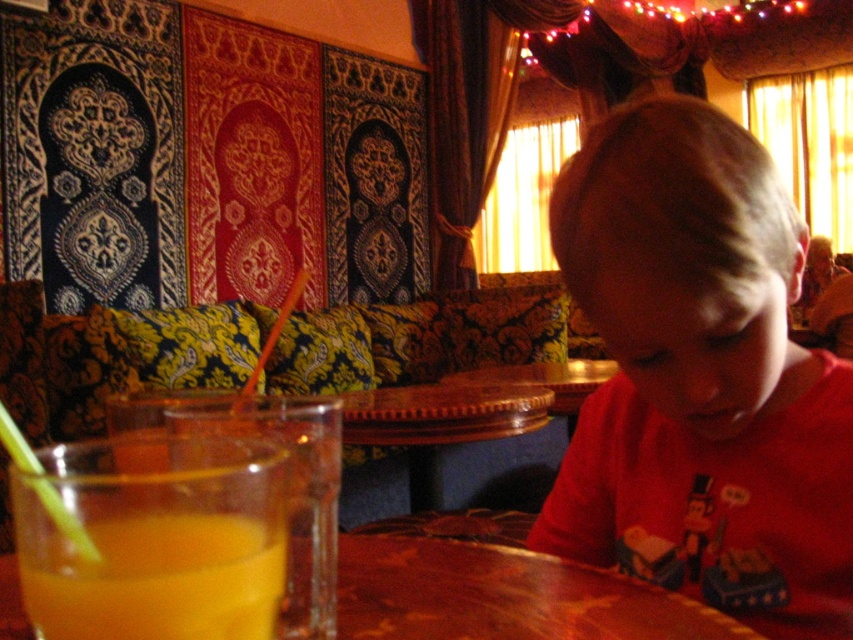
Can you confirm if red matte shirt at lower right is smaller than wooden table at center?

No.

Is red matte shirt at lower right thinner than wooden table at center?

Indeed, red matte shirt at lower right has a lesser width compared to wooden table at center.

The width and height of the screenshot is (853, 640). I want to click on red matte shirt at lower right, so click(700, 378).

Find the location of `red matte shirt at lower right`. red matte shirt at lower right is located at coordinates (700, 378).

Does red matte shirt at lower right come in front of yellow translucent liquid at lower left?

No, it is behind yellow translucent liquid at lower left.

Does red matte shirt at lower right have a smaller size compared to yellow translucent liquid at lower left?

Incorrect, red matte shirt at lower right is not smaller in size than yellow translucent liquid at lower left.

The image size is (853, 640). I want to click on red matte shirt at lower right, so click(x=700, y=378).

Where is `red matte shirt at lower right`? This screenshot has width=853, height=640. red matte shirt at lower right is located at coordinates click(x=700, y=378).

Who is positioned more to the right, yellow translucent liquid at lower left or wooden table at center?

Positioned to the right is wooden table at center.

Does yellow translucent liquid at lower left have a smaller size compared to wooden table at center?

Yes, yellow translucent liquid at lower left is smaller than wooden table at center.

The image size is (853, 640). Find the location of `yellow translucent liquid at lower left`. yellow translucent liquid at lower left is located at coordinates pos(155,538).

Where is `yellow translucent liquid at lower left`? yellow translucent liquid at lower left is located at coordinates (155, 538).